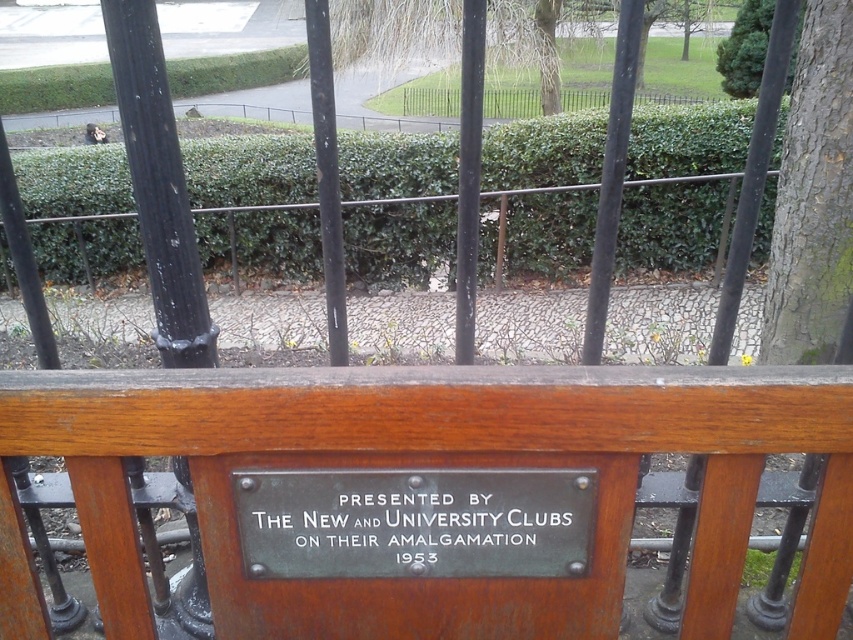
You are standing in front of the fence and want to touch both the green patina plaque at center and the green rough bark tree at right. Which object will require you to reach higher?

The green rough bark tree at right is higher than the green patina plaque at center, so you need to reach higher to touch the green rough bark tree at right.

You are standing in front of a metal fence and see the green patina plaque at center and the green rough bark tree at right. Which object is positioned to the left of the other?

The green patina plaque at center is to the left of green rough bark tree at right.

You are a gardener who needs to water both the wooden bench at center and the green leafy hedge at center. You have a hose that can reach up to 20 feet. Starting from the bench, can you water the hedge without moving the hose nozzle?

The distance between the wooden bench at center and the green leafy hedge at center is 23.39 feet, which is longer than the hose can reach. Therefore, you cannot water the hedge without moving the hose nozzle.